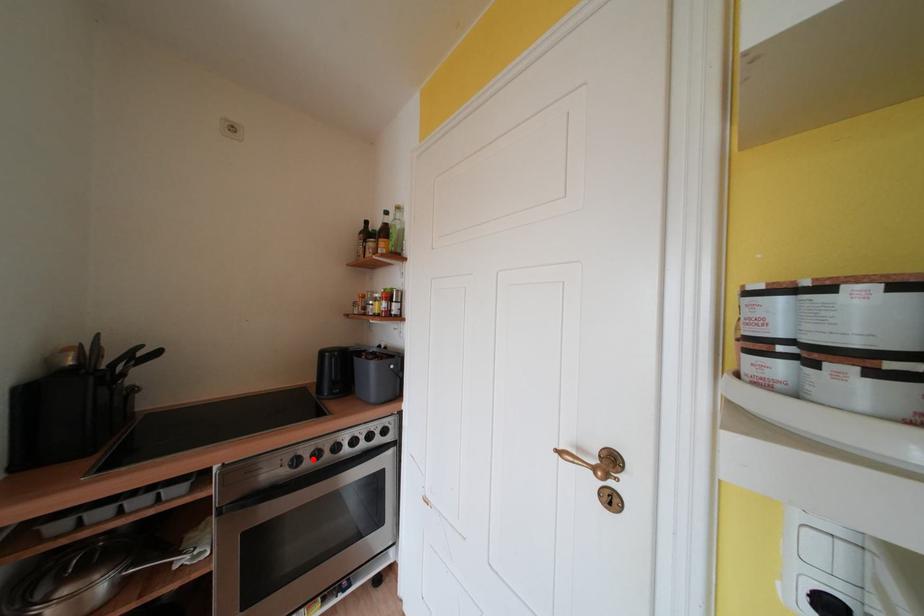
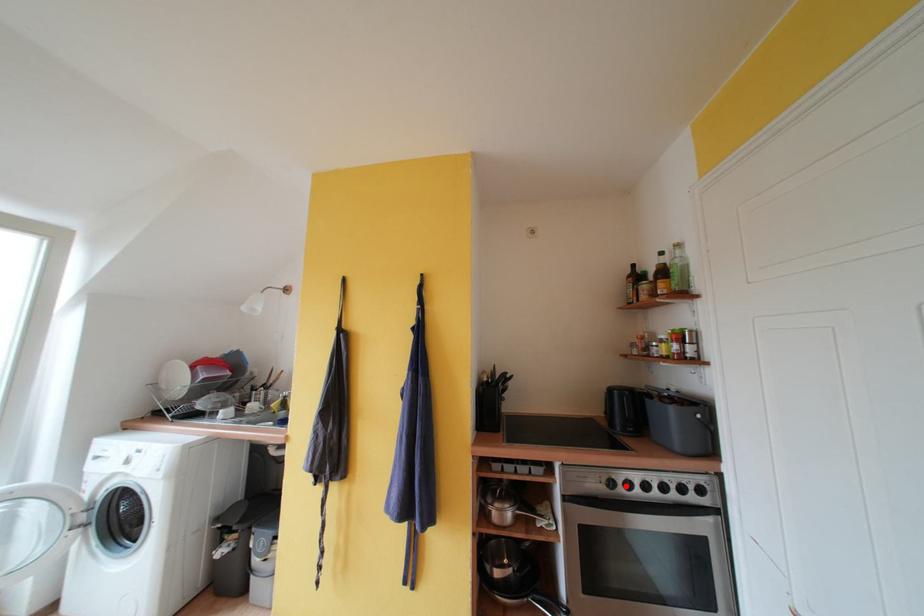
I am providing you with two images of the same scene from different viewpoints. A red point is marked on the first image and another point is marked on the second image. Do the highlighted points in image1 and image2 indicate the same real-world spot?

Yes